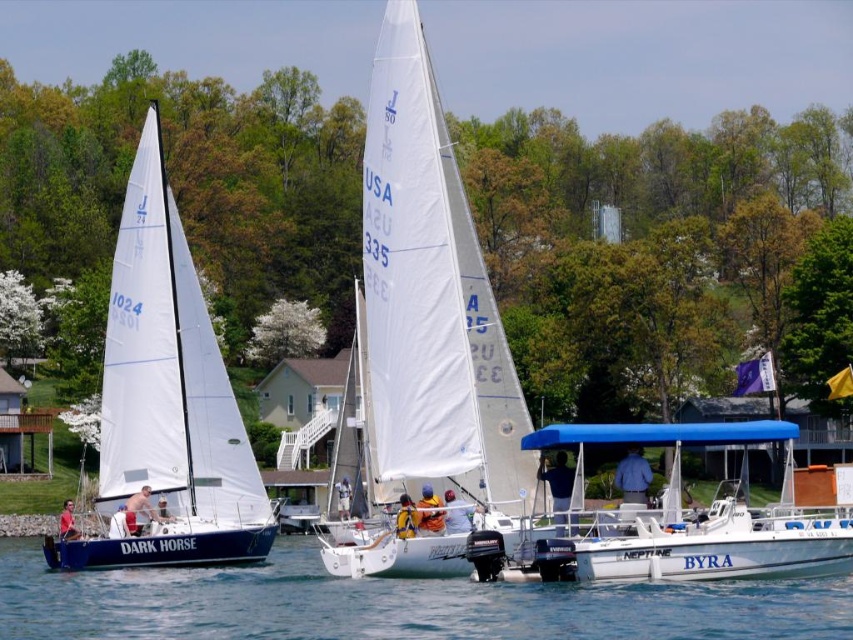
Question: Among these objects, which one is farthest from the camera?

Choices:
 (A) white sailboat at left
 (B) white sailboat at center
 (C) transparent blue water at center
 (D) white matte motorboat at lower right

Answer: (A)

Question: Does white sailboat at center appear on the left side of white sailboat at left?

Choices:
 (A) yes
 (B) no

Answer: (B)

Question: Is white sailboat at left closer to the viewer compared to white matte motorboat at lower right?

Choices:
 (A) no
 (B) yes

Answer: (A)

Question: Which point is closer to the camera?

Choices:
 (A) (160, 403)
 (B) (456, 540)
 (C) (717, 589)

Answer: (C)

Question: Is transparent blue water at center below white sailboat at left?

Choices:
 (A) no
 (B) yes

Answer: (B)

Question: Which point is farther to the camera?

Choices:
 (A) white sailboat at center
 (B) transparent blue water at center
 (C) white matte motorboat at lower right
 (D) white sailboat at left

Answer: (D)